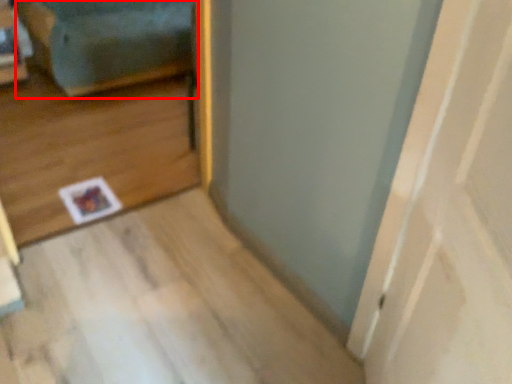
Question: From the image's perspective, what is the correct spatial positioning of couch (annotated by the red box) in reference to door?

Choices:
 (A) below
 (B) above

Answer: (B)